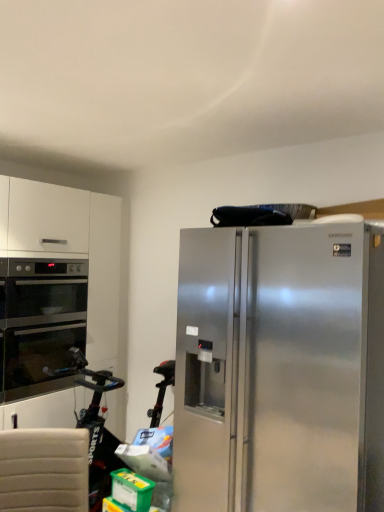
Locate an element on the screen. This screenshot has width=384, height=512. stainless steel oven at left is located at coordinates (40, 323).

The height and width of the screenshot is (512, 384). Describe the element at coordinates (40, 323) in the screenshot. I see `stainless steel oven at left` at that location.

Find the location of a particular element. stainless steel refrigerator at right is located at coordinates (280, 369).

The height and width of the screenshot is (512, 384). Describe the element at coordinates (280, 369) in the screenshot. I see `stainless steel refrigerator at right` at that location.

Locate an element on the screen. This screenshot has width=384, height=512. stainless steel oven at left is located at coordinates (40, 323).

Is stainless steel oven at left at the left side of stainless steel refrigerator at right?

Yes.

Based on the photo, is the position of stainless steel oven at left more distant than that of stainless steel refrigerator at right?

Yes, stainless steel oven at left is behind stainless steel refrigerator at right.

From the picture: Which is closer to the camera, [77,331] or [194,477]?

Point [77,331] appears to be farther away from the viewer than point [194,477].

From the image's perspective, would you say stainless steel oven at left is shown under stainless steel refrigerator at right?

No, from the image's perspective, stainless steel oven at left is not beneath stainless steel refrigerator at right.

From a real-world perspective, is stainless steel oven at left over stainless steel refrigerator at right?

Yes.

Is stainless steel oven at left thinner than stainless steel refrigerator at right?

Yes.

Considering the relative sizes of stainless steel oven at left and stainless steel refrigerator at right in the image provided, is stainless steel oven at left shorter than stainless steel refrigerator at right?

Correct, stainless steel oven at left is not as tall as stainless steel refrigerator at right.

Can you confirm if stainless steel oven at left is smaller than stainless steel refrigerator at right?

Indeed, stainless steel oven at left has a smaller size compared to stainless steel refrigerator at right.

Is stainless steel refrigerator at right a part of stainless steel oven at left?

No, stainless steel refrigerator at right is not surrounded by stainless steel oven at left.

Would you say stainless steel oven at left is a long distance from stainless steel refrigerator at right?

Yes, stainless steel oven at left is far from stainless steel refrigerator at right.

Is stainless steel oven at left facing away from stainless steel refrigerator at right?

No.

How distant is stainless steel oven at left from stainless steel refrigerator at right?

1.23 meters.

At what (x,y) coordinates should I click in order to perform the action: click on oven above the stainless steel refrigerator at right (from the image's perspective). Please return your answer as a coordinate pair (x, y). This screenshot has width=384, height=512. Looking at the image, I should click on (40, 323).

In the image, is stainless steel refrigerator at right on the left side or the right side of stainless steel oven at left?

Based on their positions, stainless steel refrigerator at right is located to the right of stainless steel oven at left.

Is the position of stainless steel refrigerator at right more distant than that of stainless steel oven at left?

That is False.

Does point (313, 286) lie in front of point (80, 279)?

Yes, it is in front of point (80, 279).

From the image's perspective, between stainless steel refrigerator at right and stainless steel oven at left, which one is located above?

stainless steel oven at left, from the image's perspective.

From a real-world perspective, which object rests below the other?

stainless steel refrigerator at right is physically lower.

Does stainless steel refrigerator at right have a lesser width compared to stainless steel oven at left?

In fact, stainless steel refrigerator at right might be wider than stainless steel oven at left.

In the scene shown: Who is taller, stainless steel refrigerator at right or stainless steel oven at left?

With more height is stainless steel refrigerator at right.

Looking at this image, considering the relative sizes of stainless steel refrigerator at right and stainless steel oven at left in the image provided, is stainless steel refrigerator at right bigger than stainless steel oven at left?

Yes.

Is stainless steel refrigerator at right completely or partially outside of stainless steel oven at left?

Yes, stainless steel refrigerator at right is located beyond the bounds of stainless steel oven at left.

Is stainless steel refrigerator at right not near stainless steel oven at left?

Yes, stainless steel refrigerator at right is far from stainless steel oven at left.

Is stainless steel refrigerator at right aimed at stainless steel oven at left?

No.

Identify the location of oven on the left of stainless steel refrigerator at right. The image size is (384, 512). (40, 323).

The height and width of the screenshot is (512, 384). What are the coordinates of `oven above the stainless steel refrigerator at right (from a real-world perspective)` in the screenshot? It's located at (40, 323).

The width and height of the screenshot is (384, 512). Identify the location of refrigerator below the stainless steel oven at left (from a real-world perspective). (280, 369).